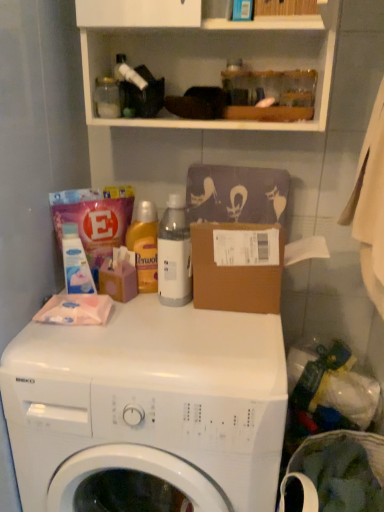
Find the location of `vacant region above white glossy washing machine at center (from a real-world perspective)`. vacant region above white glossy washing machine at center (from a real-world perspective) is located at coordinates (164, 326).